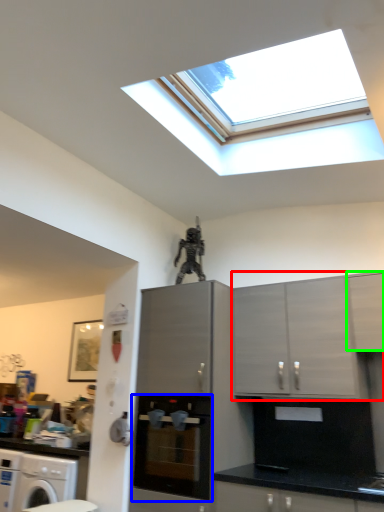
Question: Considering the real-world distances, which object is closest to cabinetry (highlighted by a red box)? home appliance (highlighted by a blue box) or cabinetry (highlighted by a green box).

Choices:
 (A) home appliance
 (B) cabinetry

Answer: (B)